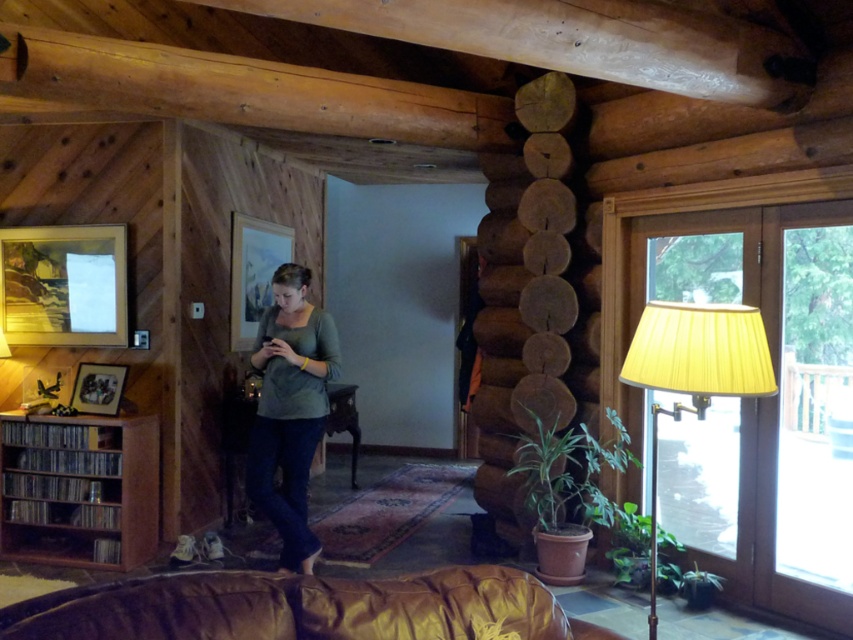
You are a guest in this rustic cabin and want to place a small side table between the brown leather couch at lower center and the yellow pleated shade at right. Considering their sizes, will the side table fit comfortably?

The brown leather couch at lower center is smaller than the yellow pleated shade at right. Therefore, placing a small side table between them should fit comfortably as there is enough space between the two objects.

You are organizing items in a rustic cabin. You have a green matte shirt at center and a brown wooden bookshelf at lower left. Which object is wider?

The brown wooden bookshelf at lower left is wider than the green matte shirt at center.